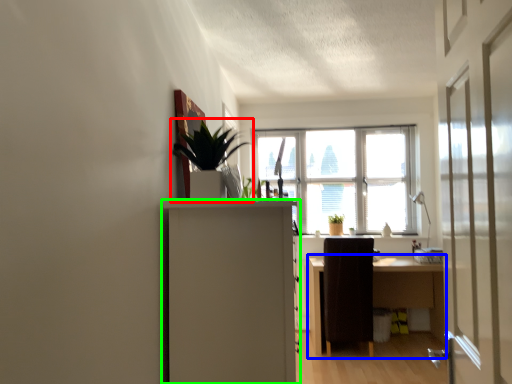
Question: Considering the real-world distances, which object is closest to houseplant (highlighted by a red box)? desk (highlighted by a blue box) or cabinetry (highlighted by a green box).

Choices:
 (A) desk
 (B) cabinetry

Answer: (B)